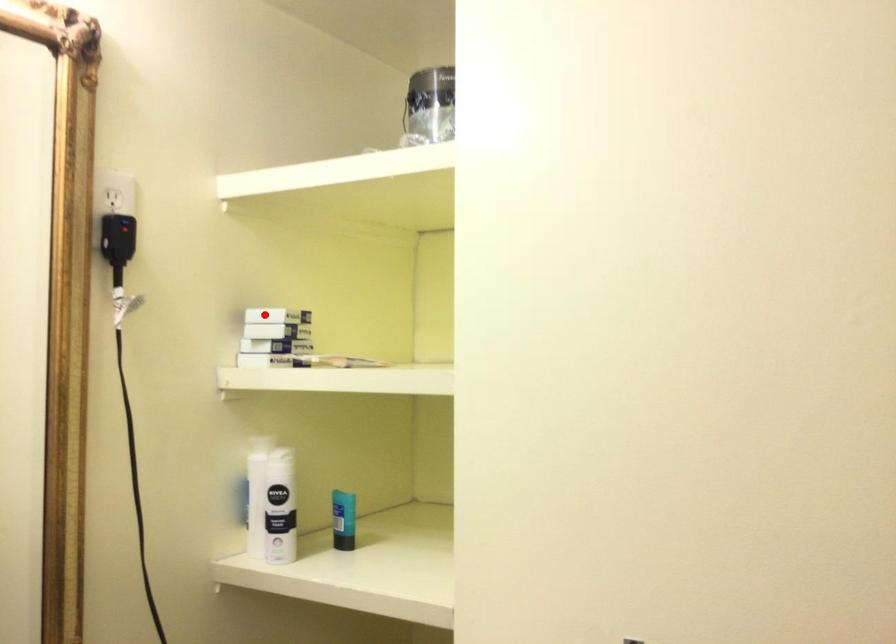
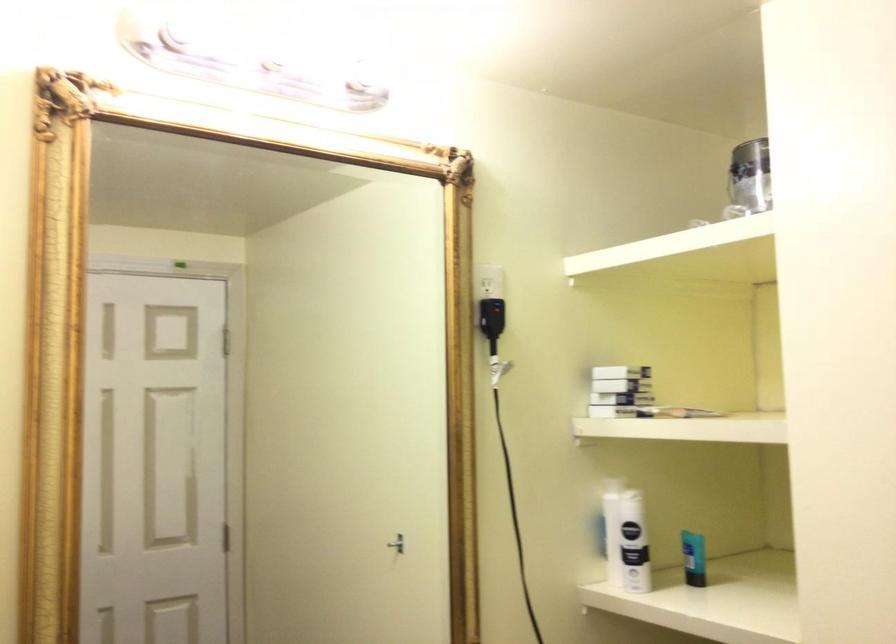
Question: I am providing you with two images of the same scene from different viewpoints. A red point is shown in image1. For the corresponding object point in image2, is it positioned nearer or farther from the camera?

Choices:
 (A) Nearer
 (B) Farther

Answer: (B)